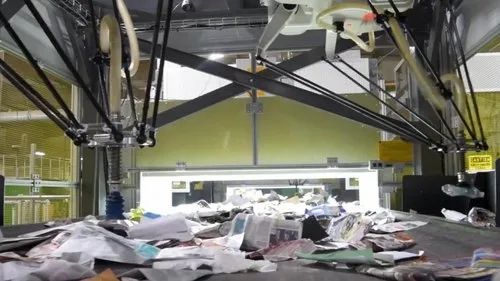
Locate an element on the screen. This screenshot has height=281, width=500. shades is located at coordinates (32, 47), (470, 29).